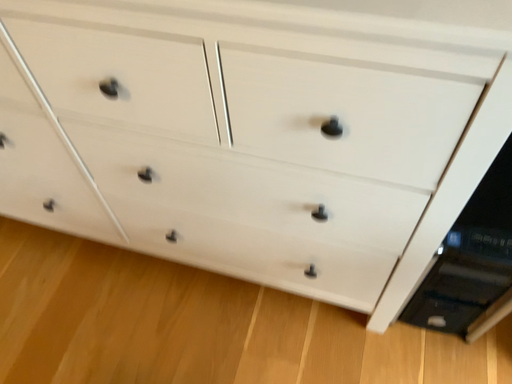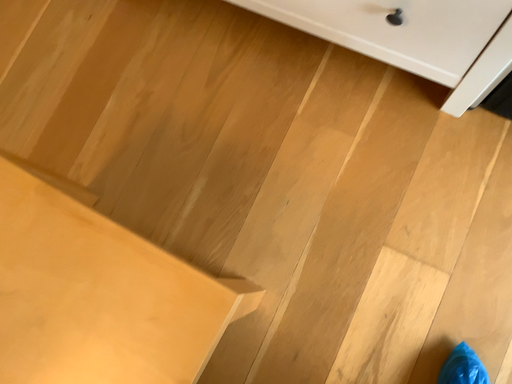
Question: Which way did the camera rotate in the video?

Choices:
 (A) rotated downward
 (B) rotated upward

Answer: (A)